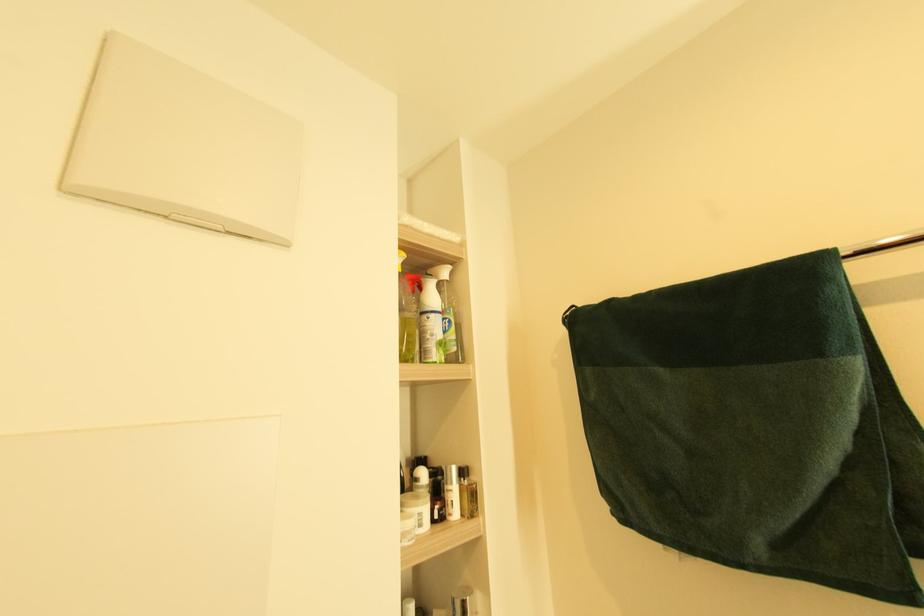
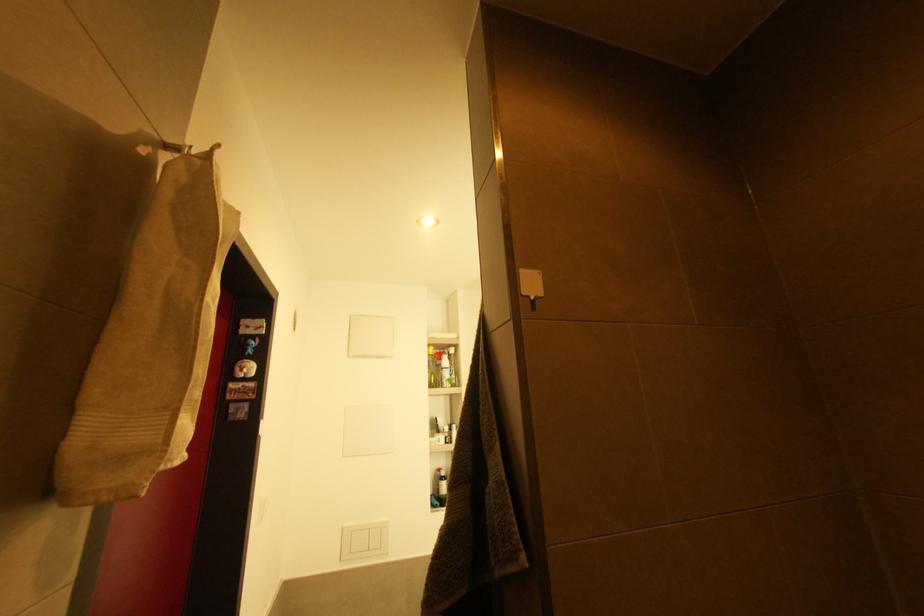
The images are taken continuously from a first-person perspective. In which direction are you moving?

The cameraman moved toward right, backward.